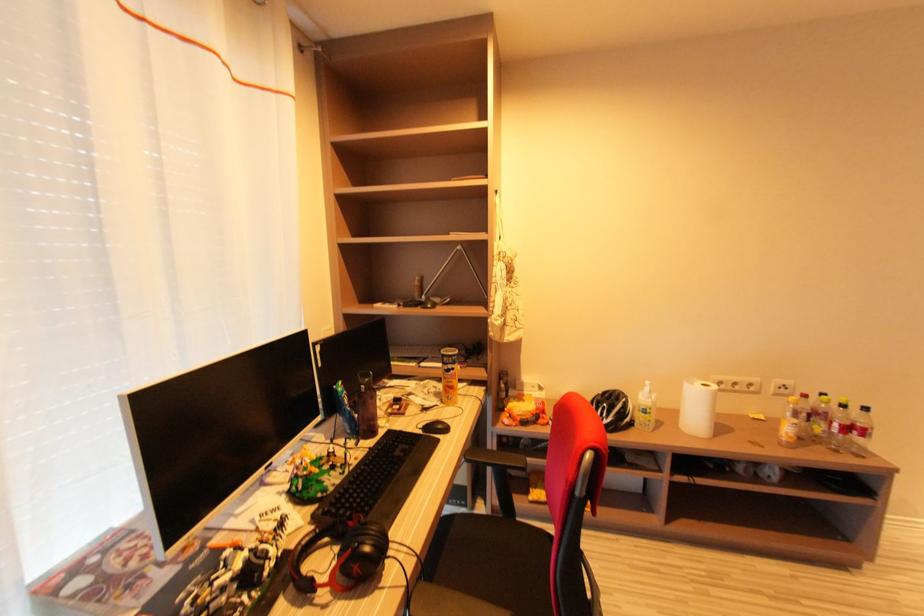
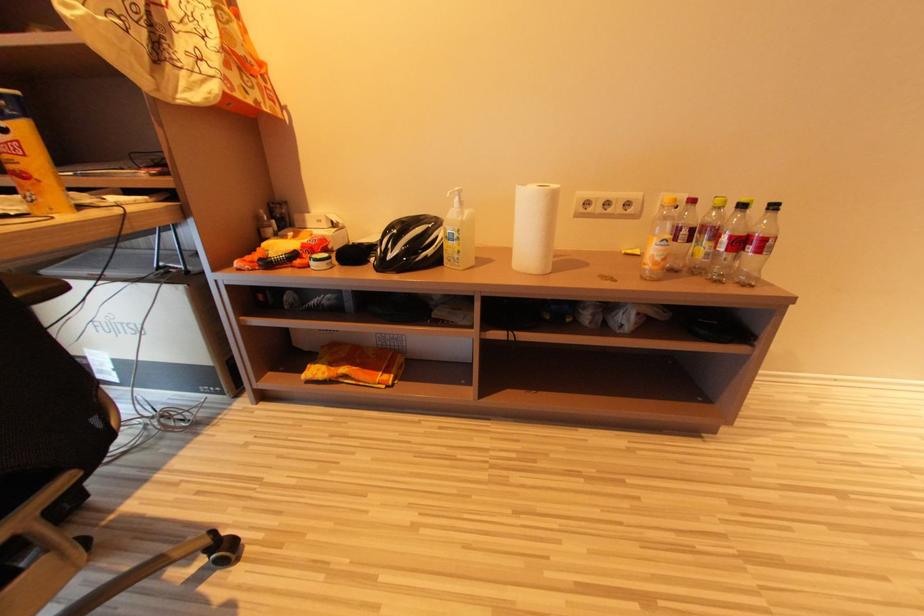
Which direction would the cameraman need to move to produce the second image?

The movement direction of the cameraman is right, forward.